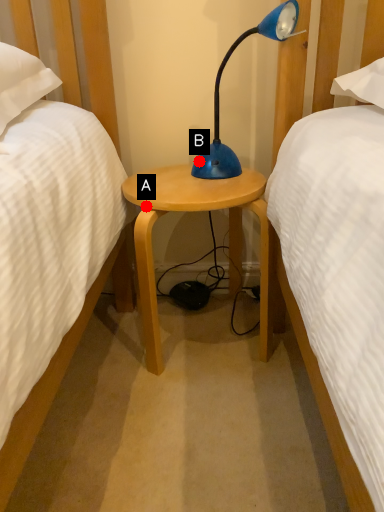
Question: Two points are circled on the image, labeled by A and B beside each circle. Which point appears farthest from the camera in this image?

Choices:
 (A) A is further
 (B) B is further

Answer: (B)